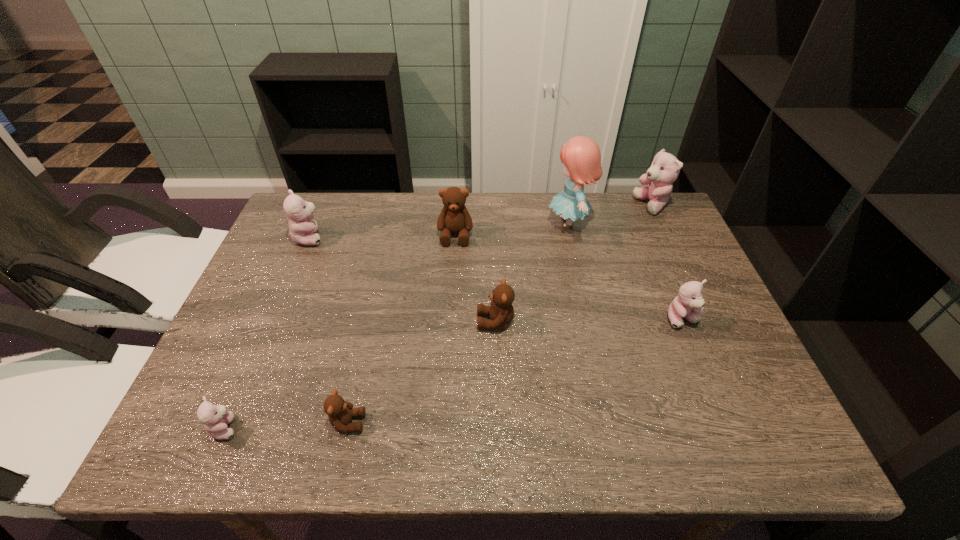
Where is `unoccupied position between the nearest pink teddy bear and the blue doll`? This screenshot has width=960, height=540. unoccupied position between the nearest pink teddy bear and the blue doll is located at coordinates [397, 325].

Locate an element on the screen. free area in between the blue doll and the third farthest pink teddy bear is located at coordinates (626, 271).

I want to click on empty space between the tallest teddy bear and the second nearest pink teddy bear, so click(x=667, y=262).

Where is `free space between the fifth object from left to right and the third smallest pink teddy bear`? This screenshot has width=960, height=540. free space between the fifth object from left to right and the third smallest pink teddy bear is located at coordinates (402, 280).

Identify which object is located as the fifth nearest to the third biggest pink teddy bear. Please provide its 2D coordinates. Your answer should be formatted as a tuple, i.e. [(x, y)], where the tuple contains the x and y coordinates of a point satisfying the conditions above.

[(340, 412)]

Select which object appears as the third closest to the third farthest pink teddy bear. Please provide its 2D coordinates. Your answer should be formatted as a tuple, i.e. [(x, y)], where the tuple contains the x and y coordinates of a point satisfying the conditions above.

[(665, 168)]

Locate an element on the screen. The image size is (960, 540). the closest teddy bear to the second nearest pink teddy bear is located at coordinates (501, 312).

Image resolution: width=960 pixels, height=540 pixels. Identify the location of teddy bear that is the fifth closest to the farthest teddy bear. (340, 412).

Locate an element on the screen. The width and height of the screenshot is (960, 540). pink teddy bear that can be found as the closest to the farthest pink teddy bear is located at coordinates (688, 304).

Find the location of a particular element. pink teddy bear that stands as the closest to the third smallest pink teddy bear is located at coordinates (215, 418).